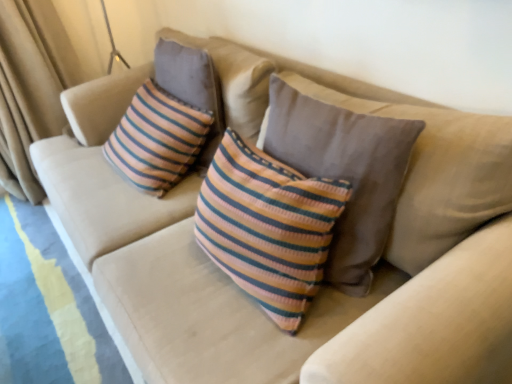
Question: Should I look upward or downward to see knitted striped pillow at center?

Choices:
 (A) up
 (B) down

Answer: (A)

Question: Is knitted striped pillow at center shorter than beige fabric curtain at left?

Choices:
 (A) no
 (B) yes

Answer: (B)

Question: Can we say knitted striped pillow at center lies outside beige fabric curtain at left?

Choices:
 (A) yes
 (B) no

Answer: (A)

Question: Is knitted striped pillow at center oriented away from beige fabric curtain at left?

Choices:
 (A) no
 (B) yes

Answer: (A)

Question: Considering the relative sizes of knitted striped pillow at center and beige fabric curtain at left in the image provided, is knitted striped pillow at center thinner than beige fabric curtain at left?

Choices:
 (A) yes
 (B) no

Answer: (A)

Question: From the image's perspective, is knitted striped pillow at center below beige fabric curtain at left?

Choices:
 (A) yes
 (B) no

Answer: (A)

Question: Is knitted striped pillow at center positioned far away from beige fabric curtain at left?

Choices:
 (A) yes
 (B) no

Answer: (A)

Question: From the image's perspective, is beige fabric curtain at left under knitted striped pillow at center?

Choices:
 (A) no
 (B) yes

Answer: (A)

Question: Can you confirm if beige fabric curtain at left is taller than knitted striped pillow at center?

Choices:
 (A) no
 (B) yes

Answer: (B)

Question: Is beige fabric curtain at left oriented towards knitted striped pillow at center?

Choices:
 (A) no
 (B) yes

Answer: (B)

Question: Does beige fabric curtain at left lie in front of knitted striped pillow at center?

Choices:
 (A) no
 (B) yes

Answer: (A)

Question: Are beige fabric curtain at left and knitted striped pillow at center far apart?

Choices:
 (A) no
 (B) yes

Answer: (B)

Question: Is beige fabric curtain at left facing away from knitted striped pillow at center?

Choices:
 (A) no
 (B) yes

Answer: (A)

Question: Visually, is knitted striped pillow at center positioned to the left or to the right of beige fabric curtain at left?

Choices:
 (A) right
 (B) left

Answer: (A)